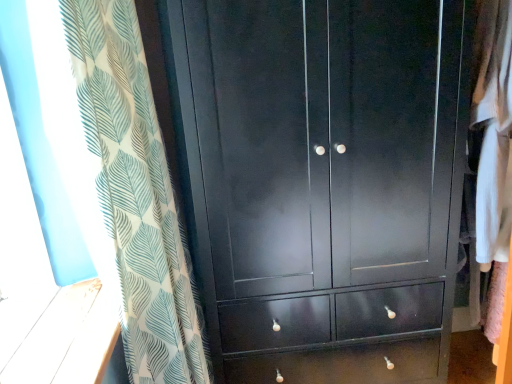
Question: Is white leaf-patterned curtain at left at the back of matte black wardrobe at center?

Choices:
 (A) yes
 (B) no

Answer: (B)

Question: Is matte black wardrobe at center at the left side of white leaf-patterned curtain at left?

Choices:
 (A) no
 (B) yes

Answer: (A)

Question: From a real-world perspective, is matte black wardrobe at center located beneath white leaf-patterned curtain at left?

Choices:
 (A) no
 (B) yes

Answer: (B)

Question: Does matte black wardrobe at center have a lesser width compared to white leaf-patterned curtain at left?

Choices:
 (A) yes
 (B) no

Answer: (B)

Question: Is matte black wardrobe at center shorter than white leaf-patterned curtain at left?

Choices:
 (A) no
 (B) yes

Answer: (A)

Question: Is matte black wardrobe at center smaller than white leaf-patterned curtain at left?

Choices:
 (A) no
 (B) yes

Answer: (A)

Question: Does white leaf-patterned curtain at left come behind matte black wardrobe at center?

Choices:
 (A) yes
 (B) no

Answer: (B)

Question: Is white leaf-patterned curtain at left positioned with its back to matte black wardrobe at center?

Choices:
 (A) yes
 (B) no

Answer: (A)

Question: Could you tell me if white leaf-patterned curtain at left is facing matte black wardrobe at center?

Choices:
 (A) no
 (B) yes

Answer: (B)

Question: Can you confirm if white leaf-patterned curtain at left is wider than matte black wardrobe at center?

Choices:
 (A) yes
 (B) no

Answer: (B)

Question: Is white leaf-patterned curtain at left not inside matte black wardrobe at center?

Choices:
 (A) no
 (B) yes

Answer: (B)

Question: Considering the relative positions of white leaf-patterned curtain at left and matte black wardrobe at center in the image provided, is white leaf-patterned curtain at left to the right of matte black wardrobe at center from the viewer's perspective?

Choices:
 (A) no
 (B) yes

Answer: (A)

Question: Is point (260, 213) positioned closer to the camera than point (111, 71)?

Choices:
 (A) closer
 (B) farther

Answer: (B)